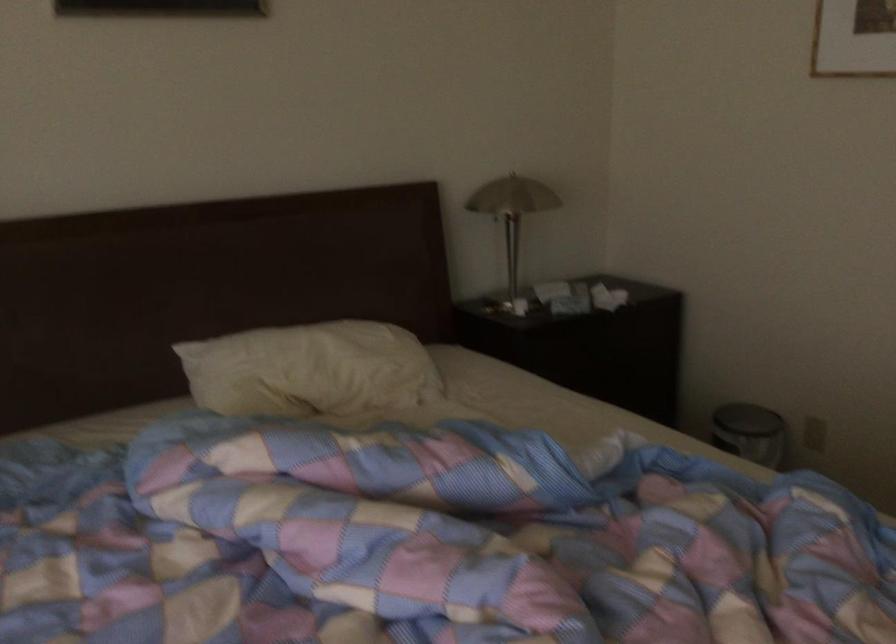
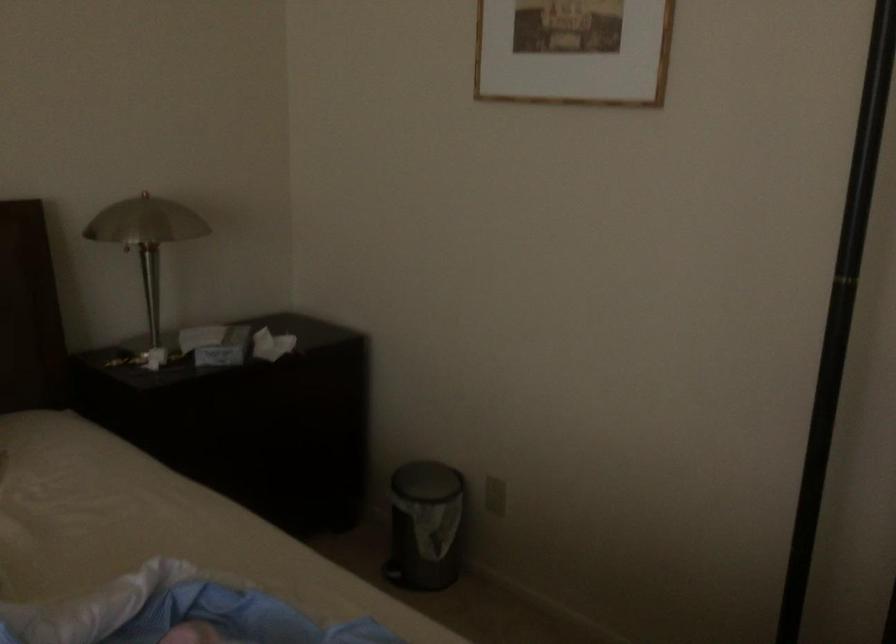
The point at (x=514, y=303) is marked in the first image. Where is the corresponding point in the second image?

(151, 357)